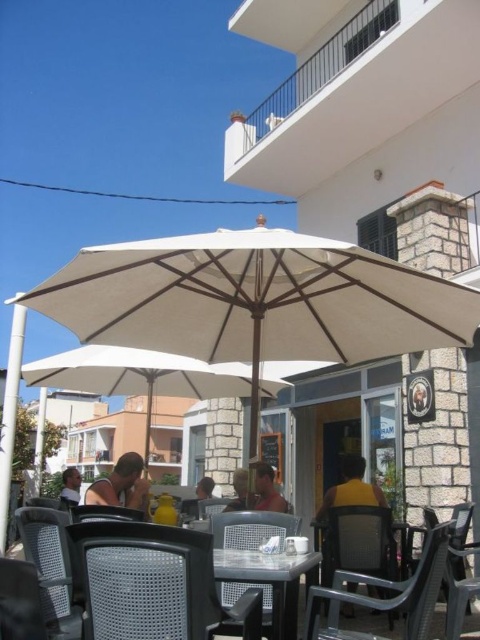
You are standing in the outdoor seating area of the cafe and want to know how far the point at coordinates (343, 460) is from you. Can you determine the distance?

The point at coordinates (343, 460) is 32.11 feet away from the viewer.

You are taking a photo of the outdoor seating area and want to focus on both point (264,497) and point (79,474). Which point should you adjust your focus to first to ensure both are in sharp view?

Point (264,497) is closer to the camera than point (79,474). To ensure both are in focus, you should adjust your focus to the closer point first, which is point (264,497).